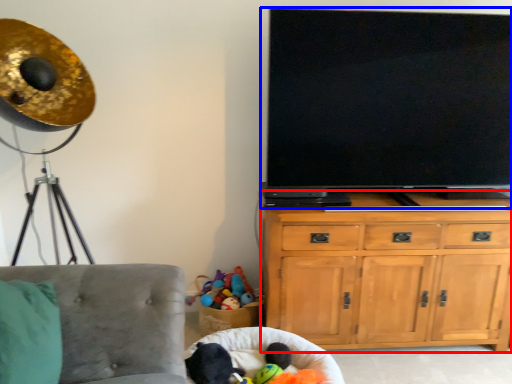
Question: Which object is further to the camera taking this photo, cabinetry (highlighted by a red box) or television (highlighted by a blue box)?

Choices:
 (A) cabinetry
 (B) television

Answer: (A)